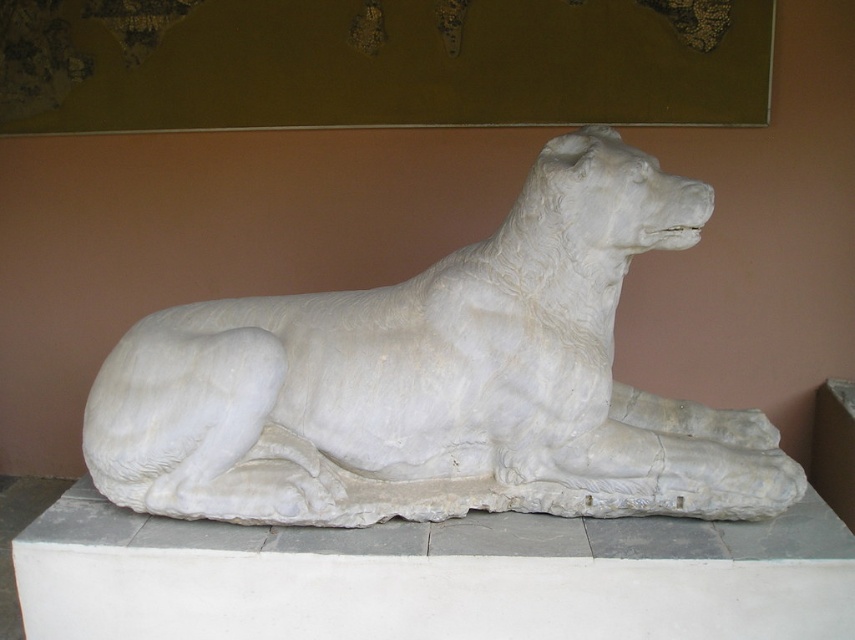
Question: Observing the image, what is the correct spatial positioning of white marble lion at center in reference to white marble dog at center?

Choices:
 (A) below
 (B) above

Answer: (B)

Question: Among these objects, which one is farthest from the camera?

Choices:
 (A) white marble dog at center
 (B) white marble lion at center

Answer: (B)

Question: Does white marble lion at center lie in front of white marble dog at center?

Choices:
 (A) yes
 (B) no

Answer: (B)

Question: Does white marble lion at center have a greater width compared to white marble dog at center?

Choices:
 (A) yes
 (B) no

Answer: (B)

Question: Among these objects, which one is farthest from the camera?

Choices:
 (A) white marble dog at center
 (B) white marble lion at center

Answer: (B)